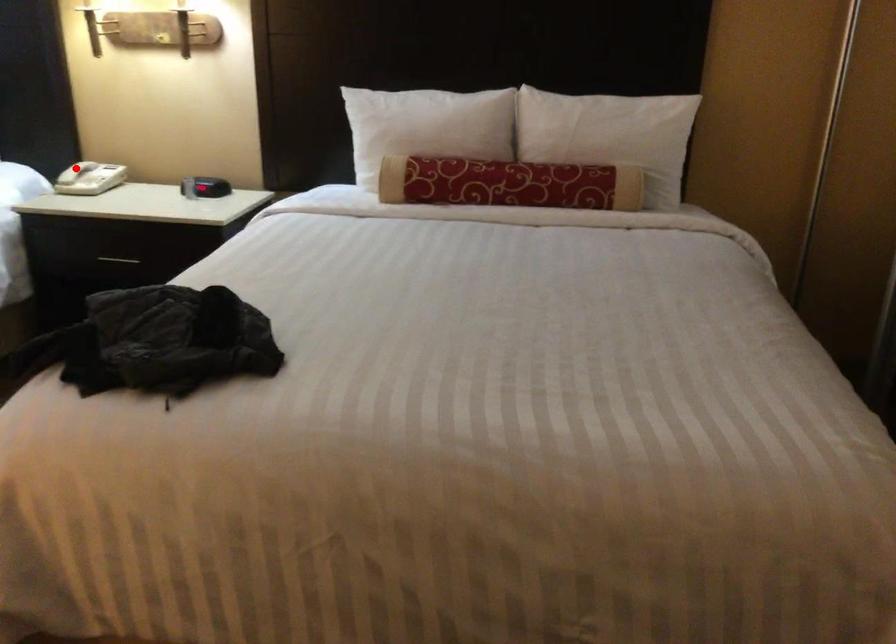
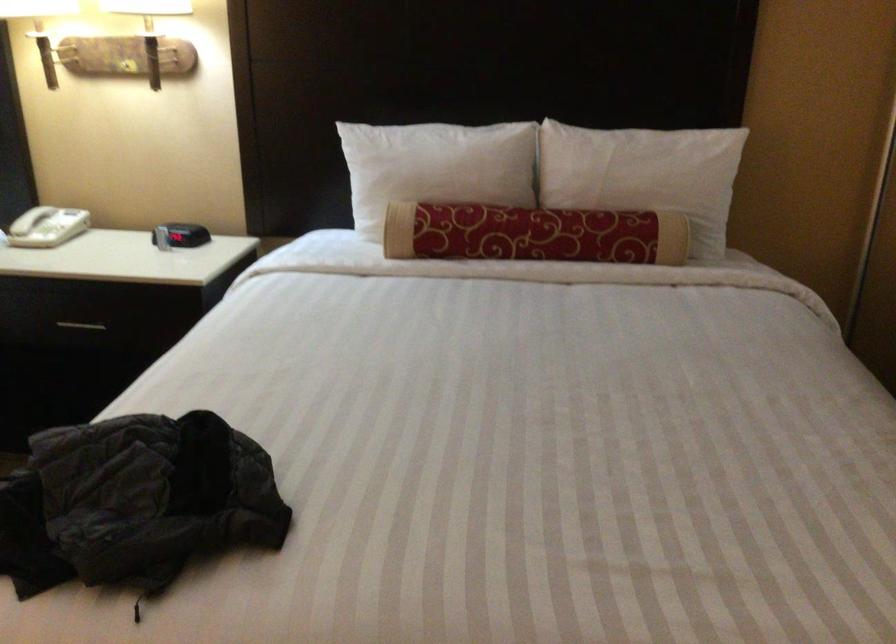
Question: A red point is marked in image1. In image2, is the corresponding 3D point closer to the camera or farther? Reply with the corresponding letter.

Choices:
 (A) The corresponding 3D point is closer.
 (B) The corresponding 3D point is farther.

Answer: (A)